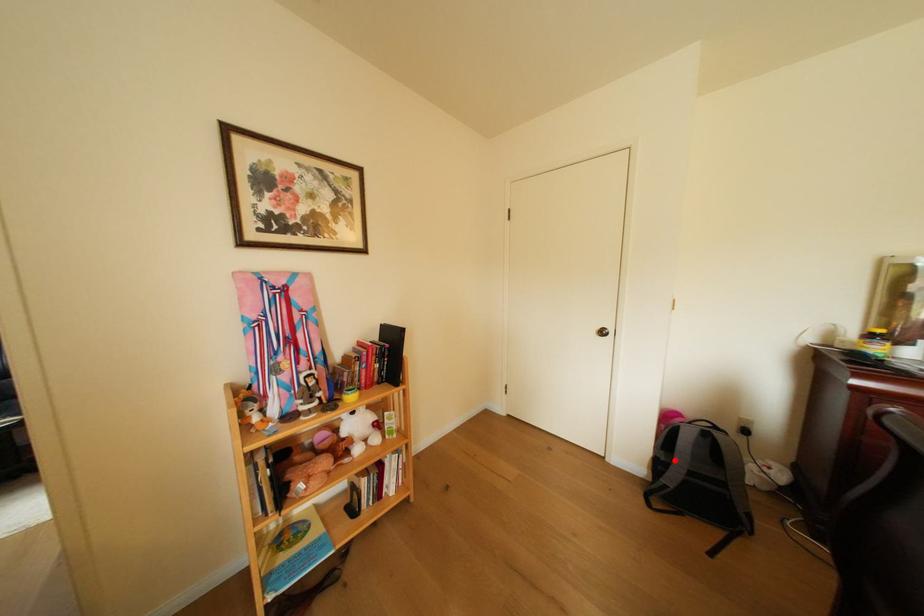
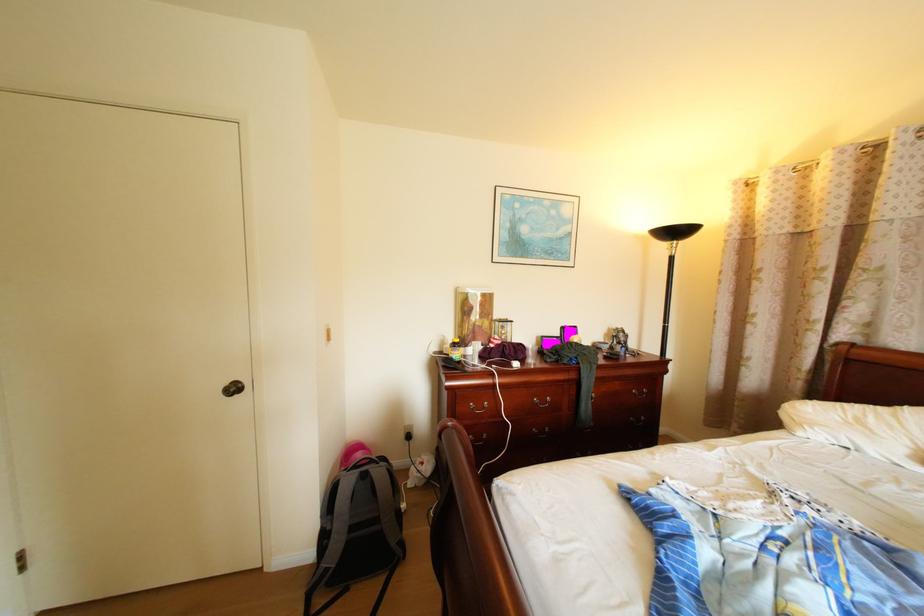
Find the pixel in the second image that matches the highlighted location in the first image.

(342, 529)